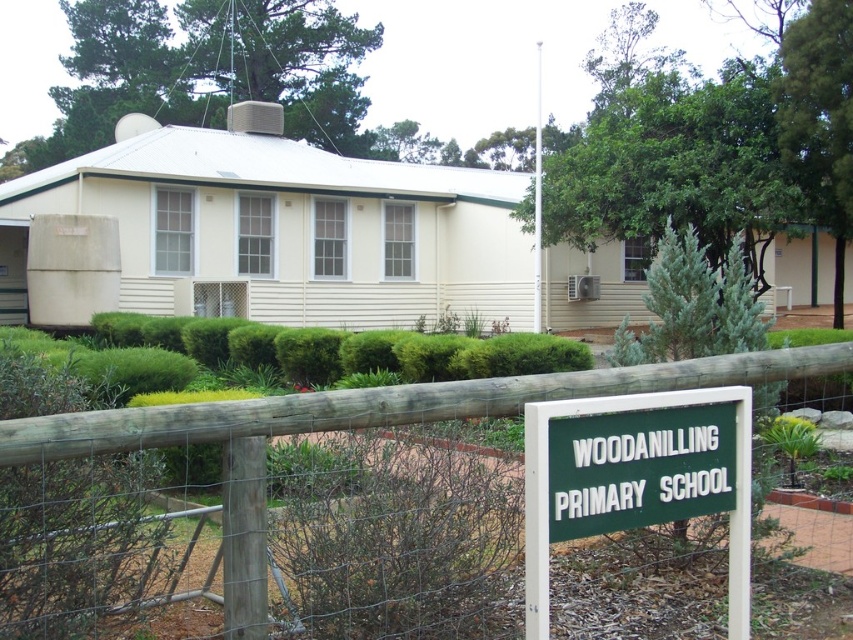
You are a visitor arriving at Woodanilling Primary School. You see a wooden fence at center and a green plastic sign at center. Which object is higher up from the ground?

The wooden fence at center is located above the green plastic sign at center, so the wooden fence at center is higher up from the ground.

You are a visitor approaching the school and see the wooden fence at center and the green plastic sign at center. Which object will you encounter first as you walk towards the school entrance?

The wooden fence at center is closer to the viewer than the green plastic sign at center, so you will encounter the wooden fence at center first as you walk towards the school entrance.